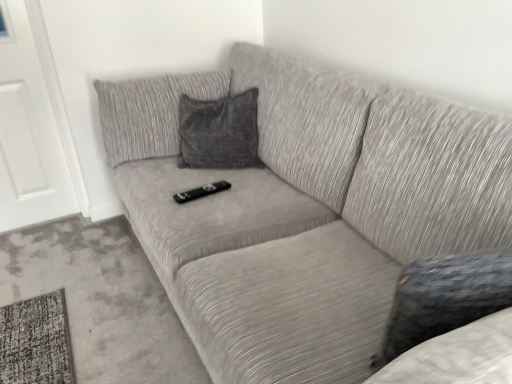
Question: Should I look upward or downward to see white matte door at left?

Choices:
 (A) down
 (B) up

Answer: (B)

Question: Is black plastic remote at center at the back of textured gray couch at center?

Choices:
 (A) yes
 (B) no

Answer: (A)

Question: From a real-world perspective, is textured gray couch at center under black plastic remote at center?

Choices:
 (A) yes
 (B) no

Answer: (A)

Question: Is textured gray couch at center in contact with black plastic remote at center?

Choices:
 (A) yes
 (B) no

Answer: (B)

Question: Is the depth of textured gray couch at center greater than that of black plastic remote at center?

Choices:
 (A) yes
 (B) no

Answer: (B)

Question: Is textured gray couch at center to the left of black plastic remote at center from the viewer's perspective?

Choices:
 (A) no
 (B) yes

Answer: (A)

Question: Is textured gray couch at center wider than black plastic remote at center?

Choices:
 (A) yes
 (B) no

Answer: (A)

Question: Can you confirm if black plastic remote at center is shorter than textured gray couch at center?

Choices:
 (A) yes
 (B) no

Answer: (A)

Question: Is black plastic remote at center to the left of textured gray couch at center from the viewer's perspective?

Choices:
 (A) no
 (B) yes

Answer: (B)

Question: Does black plastic remote at center have a lesser width compared to textured gray couch at center?

Choices:
 (A) no
 (B) yes

Answer: (B)

Question: Is black plastic remote at center to the right of textured gray couch at center from the viewer's perspective?

Choices:
 (A) no
 (B) yes

Answer: (A)

Question: Could you tell me if black plastic remote at center is facing textured gray couch at center?

Choices:
 (A) no
 (B) yes

Answer: (B)

Question: Can you confirm if black plastic remote at center is wider than textured gray couch at center?

Choices:
 (A) yes
 (B) no

Answer: (B)

Question: Does white matte door at left have a lesser height compared to black plastic remote at center?

Choices:
 (A) no
 (B) yes

Answer: (A)